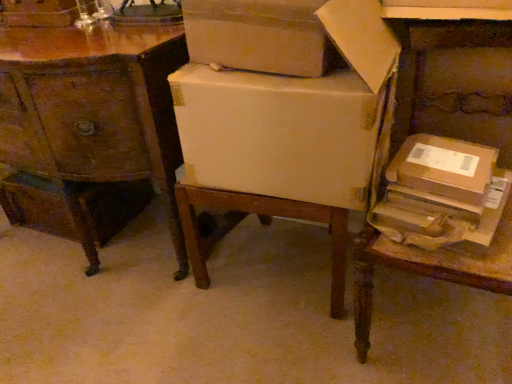
Describe the element at coordinates (444, 168) in the screenshot. I see `brown cardboard box at right, which appears as the first cardboard box when viewed from the right` at that location.

The width and height of the screenshot is (512, 384). What do you see at coordinates (455, 82) in the screenshot?
I see `brown wooden table at right` at bounding box center [455, 82].

Describe the element at coordinates (260, 36) in the screenshot. I see `white cardboard box at upper center` at that location.

Locate an element on the screen. The image size is (512, 384). brown cardboard box at right, the second storage box viewed from the left is located at coordinates (442, 193).

The image size is (512, 384). In order to click on wooden drawer at left, the second storage box when ordered from front to back in this screenshot , I will do `click(112, 205)`.

Consider the image. In the image, is brown wooden table at right on the left side or the right side of brown cardboard box at right, marked as the second cardboard box in a left-to-right arrangement?

In the image, brown wooden table at right appears on the right side of brown cardboard box at right, marked as the second cardboard box in a left-to-right arrangement.

Is brown wooden table at right completely or partially outside of brown cardboard box at right, which appears as the first cardboard box when viewed from the right?

Indeed, brown wooden table at right is completely outside brown cardboard box at right, which appears as the first cardboard box when viewed from the right.

From the image's perspective, would you say brown wooden table at right is shown under brown cardboard box at right, which appears as the first cardboard box when viewed from the right?

Indeed, from the image's perspective, brown wooden table at right is shown beneath brown cardboard box at right, which appears as the first cardboard box when viewed from the right.

From a real-world perspective, who is located lower, matte cardboard box at center, the first cardboard box from the left, or brown cardboard box at right, the second storage box viewed from the left?

From a 3D spatial view, brown cardboard box at right, the second storage box viewed from the left, is below.

Is matte cardboard box at center, placed as the 2th cardboard box when sorted from right to left, situated inside brown cardboard box at right, the second storage box viewed from the left, or outside?

matte cardboard box at center, placed as the 2th cardboard box when sorted from right to left, cannot be found inside brown cardboard box at right, the second storage box viewed from the left.

Is matte cardboard box at center, the first cardboard box from the left, oriented towards brown cardboard box at right, the first storage box from the right?

No.

From the image's perspective, is matte cardboard box at center, the first cardboard box from the left, located above brown cardboard box at right, which is the second storage box in back-to-front order?

Indeed, from the image's perspective, matte cardboard box at center, the first cardboard box from the left, is shown above brown cardboard box at right, which is the second storage box in back-to-front order.

Can you confirm if wooden desk at center is positioned to the right of matte cardboard box at center, placed as the 2th cardboard box when sorted from right to left?

In fact, wooden desk at center is to the left of matte cardboard box at center, placed as the 2th cardboard box when sorted from right to left.

Considering their positions, is wooden desk at center located in front of or behind matte cardboard box at center, the first cardboard box from the left?

wooden desk at center is behind matte cardboard box at center, the first cardboard box from the left.

Is wooden desk at center not within matte cardboard box at center, placed as the 2th cardboard box when sorted from right to left?

Yes, wooden desk at center is located beyond the bounds of matte cardboard box at center, placed as the 2th cardboard box when sorted from right to left.

What are the coordinates of `the 2nd cardboard box positioned above the wooden desk at center (from a real-world perspective)` in the screenshot? It's located at (281, 133).

How different are the orientations of brown cardboard box at right, which appears as the first cardboard box when viewed from the right, and brown wooden table at right in degrees?

They differ by 6.58 degrees in their facing directions.

Is brown cardboard box at right, which appears as the first cardboard box when viewed from the right, taller or shorter than brown wooden table at right?

Considering their sizes, brown cardboard box at right, which appears as the first cardboard box when viewed from the right, has less height than brown wooden table at right.

Considering the positions of point (440, 184) and point (441, 93), is point (440, 184) closer or farther from the camera than point (441, 93)?

Point (440, 184) is positioned closer to the camera compared to point (441, 93).

Image resolution: width=512 pixels, height=384 pixels. What are the coordinates of `table lying below the brown cardboard box at right, marked as the second cardboard box in a left-to-right arrangement (from the image's perspective)` in the screenshot? It's located at (455, 82).

From the image's perspective, is wooden desk at center located above or below white cardboard box at upper center?

wooden desk at center is below white cardboard box at upper center.

From a real-world perspective, which is physically below, wooden desk at center or white cardboard box at upper center?

wooden desk at center.

Which is in front, wooden desk at center or white cardboard box at upper center?

white cardboard box at upper center is more forward.

Is wooden desk at center touching white cardboard box at upper center?

wooden desk at center is not next to white cardboard box at upper center, and they're not touching.

Between brown cardboard box at right, which is the second storage box in back-to-front order, and wooden drawer at left, the 1th storage box when ordered from left to right, which one has smaller size?

With smaller size is brown cardboard box at right, which is the second storage box in back-to-front order.

Does brown cardboard box at right, the first storage box from the right, turn towards wooden drawer at left, which is counted as the first storage box, starting from the back?

No, brown cardboard box at right, the first storage box from the right, is not turned towards wooden drawer at left, which is counted as the first storage box, starting from the back.

Does brown cardboard box at right, which is the second storage box in back-to-front order, have a greater height compared to wooden drawer at left, the second storage box when ordered from front to back?

No.

Considering the sizes of objects white cardboard box at upper center and brown wooden table at right in the image provided, who is shorter, white cardboard box at upper center or brown wooden table at right?

With less height is white cardboard box at upper center.

Considering the sizes of objects white cardboard box at upper center and brown wooden table at right in the image provided, who is smaller, white cardboard box at upper center or brown wooden table at right?

white cardboard box at upper center.

Which of these two, white cardboard box at upper center or brown wooden table at right, is wider?

Wider between the two is brown wooden table at right.

From a real-world perspective, is white cardboard box at upper center located higher than brown wooden table at right?

Yes, from a real-world perspective, white cardboard box at upper center is on top of brown wooden table at right.

The height and width of the screenshot is (384, 512). Identify the location of table below the brown cardboard box at right, marked as the second cardboard box in a left-to-right arrangement (from the image's perspective). (455, 82).

Find the location of a particular element. This screenshot has width=512, height=384. the 2nd cardboard box above the brown cardboard box at right, the 1th storage box viewed from the front (from the image's perspective) is located at coordinates (281, 133).

When comparing their distances from brown cardboard box at right, the 1th storage box viewed from the front, does wooden drawer at left, the second storage box when ordered from front to back, or brown cardboard box at right, which appears as the first cardboard box when viewed from the right, seem closer?

brown cardboard box at right, which appears as the first cardboard box when viewed from the right, is closer to brown cardboard box at right, the 1th storage box viewed from the front.

Considering their positions, is brown wooden table at right positioned further to wooden desk at center than brown cardboard box at right, marked as the second cardboard box in a left-to-right arrangement?

Based on the image, brown cardboard box at right, marked as the second cardboard box in a left-to-right arrangement, appears to be further to wooden desk at center.

Based on their spatial positions, is matte cardboard box at center, the first cardboard box from the left, or white cardboard box at upper center closer to wooden drawer at left, the 1th storage box when ordered from left to right?

Among the two, matte cardboard box at center, the first cardboard box from the left, is located nearer to wooden drawer at left, the 1th storage box when ordered from left to right.

In the scene shown: Which object lies further to the anchor point wooden desk at center, brown cardboard box at right, which appears as the first cardboard box when viewed from the right, or brown wooden table at right?

The object further to wooden desk at center is brown cardboard box at right, which appears as the first cardboard box when viewed from the right.

From the image, which object appears to be nearer to brown wooden table at right, white cardboard box at upper center or wooden drawer at left, which is counted as the first storage box, starting from the back?

Among the two, white cardboard box at upper center is located nearer to brown wooden table at right.

Looking at the image, which one is located further to brown cardboard box at right, which appears as the first cardboard box when viewed from the right, wooden desk at center or white cardboard box at upper center?

The object further to brown cardboard box at right, which appears as the first cardboard box when viewed from the right, is wooden desk at center.

From the image, which object appears to be farther from matte cardboard box at center, the first cardboard box from the left, brown cardboard box at right, marked as the second cardboard box in a left-to-right arrangement, or wooden drawer at left, which is counted as the first storage box, starting from the back?

wooden drawer at left, which is counted as the first storage box, starting from the back, lies further to matte cardboard box at center, the first cardboard box from the left, than the other object.

Based on their spatial positions, is white cardboard box at upper center or matte cardboard box at center, the first cardboard box from the left, closer to brown cardboard box at right, the second storage box viewed from the left?

matte cardboard box at center, the first cardboard box from the left, lies closer to brown cardboard box at right, the second storage box viewed from the left, than the other object.

This screenshot has width=512, height=384. I want to click on cardboard box situated between wooden drawer at left, which ranks as the second storage box in right-to-left order, and brown cardboard box at right, which appears as the first cardboard box when viewed from the right, from left to right, so click(281, 133).

I want to click on cardboard box between matte cardboard box at center, the first cardboard box from the left, and brown cardboard box at right, the second storage box viewed from the left, in the horizontal direction, so click(444, 168).

Identify the location of box between wooden desk at center and matte cardboard box at center, placed as the 2th cardboard box when sorted from right to left, in the horizontal direction. Image resolution: width=512 pixels, height=384 pixels. (260, 36).

Locate an element on the screen. Image resolution: width=512 pixels, height=384 pixels. desk located between wooden drawer at left, which ranks as the second storage box in right-to-left order, and brown wooden table at right in the left-right direction is located at coordinates (88, 121).